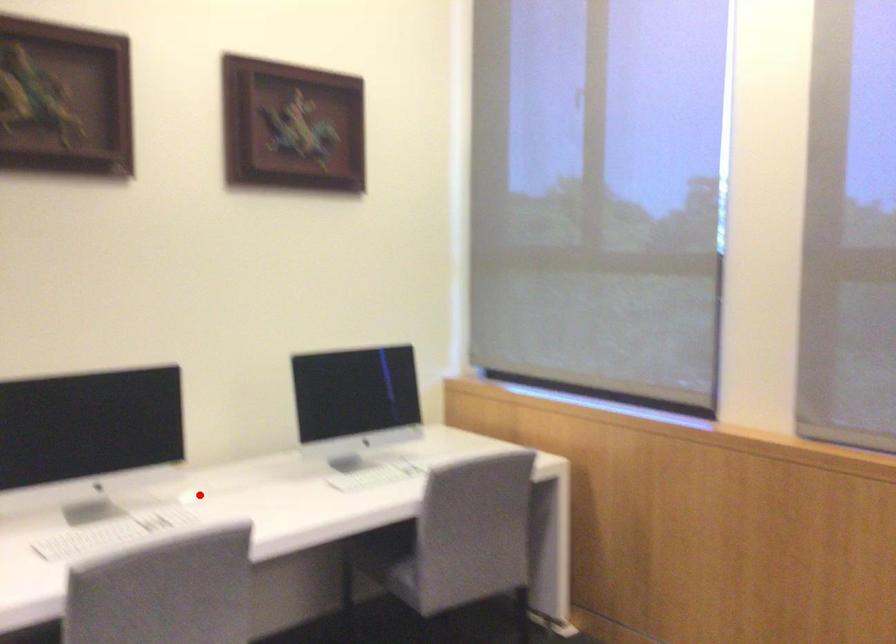
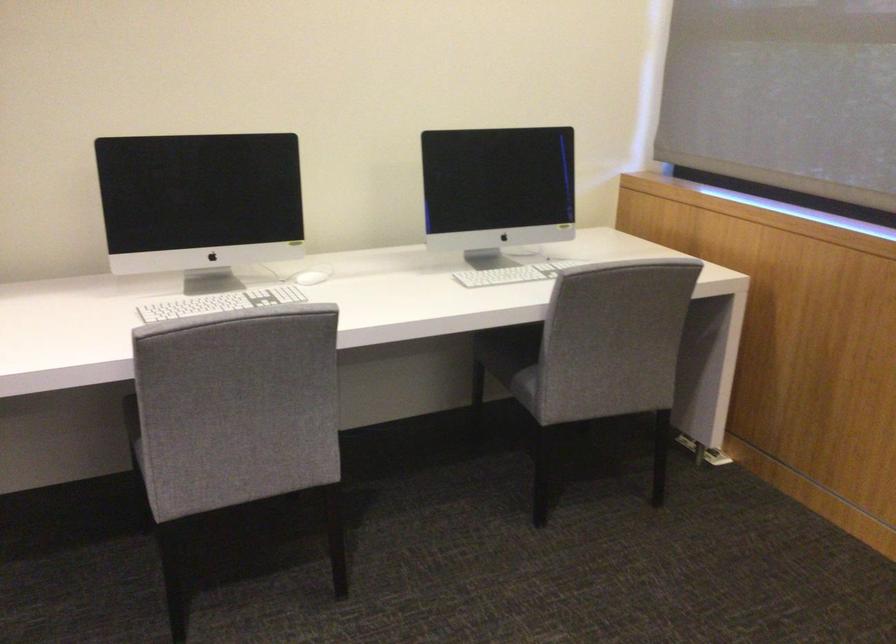
Find the pixel in the second image that matches the highlighted location in the first image.

(307, 277)